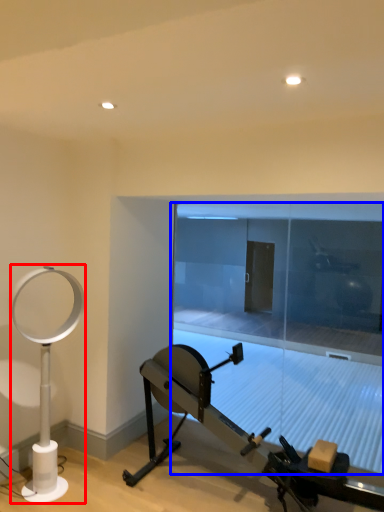
Question: Which of the following is the closest to the observer, table lamp (highlighted by a red box) or glass door (highlighted by a blue box)?

Choices:
 (A) table lamp
 (B) glass door

Answer: (A)